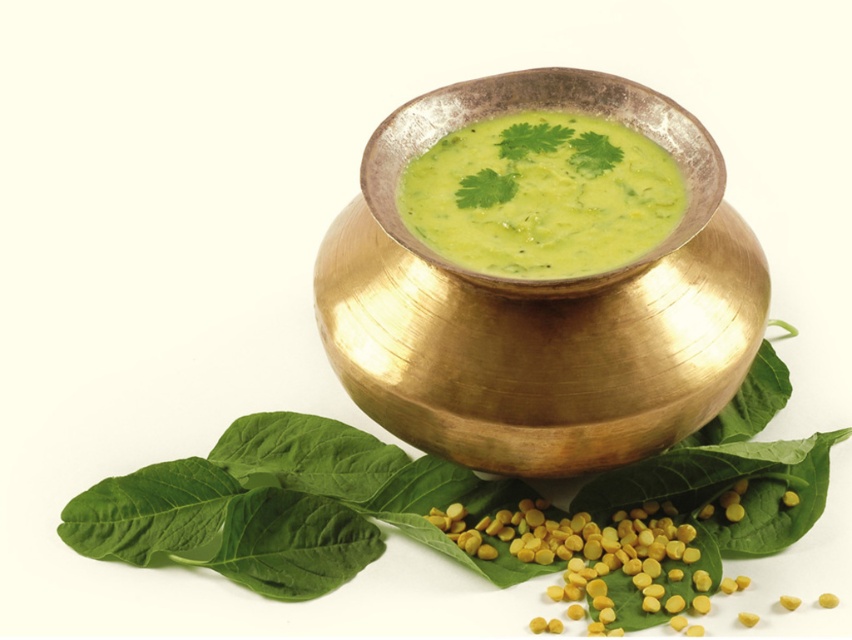
Question: Which point appears farthest from the camera in this image?

Choices:
 (A) (504, 234)
 (B) (419, 515)

Answer: (B)

Question: Is gold metallic bowl at center below green matte soup at center?

Choices:
 (A) no
 (B) yes

Answer: (B)

Question: Does green leafy basil at lower left appear over green matte soup at center?

Choices:
 (A) no
 (B) yes

Answer: (A)

Question: Is gold metallic bowl at center wider than green matte soup at center?

Choices:
 (A) yes
 (B) no

Answer: (A)

Question: Estimate the real-world distances between objects in this image. Which object is farther from the green leafy basil at lower left?

Choices:
 (A) gold metallic bowl at center
 (B) green matte soup at center

Answer: (B)

Question: Which of the following is the closest to the observer?

Choices:
 (A) (494, 109)
 (B) (527, 220)

Answer: (B)